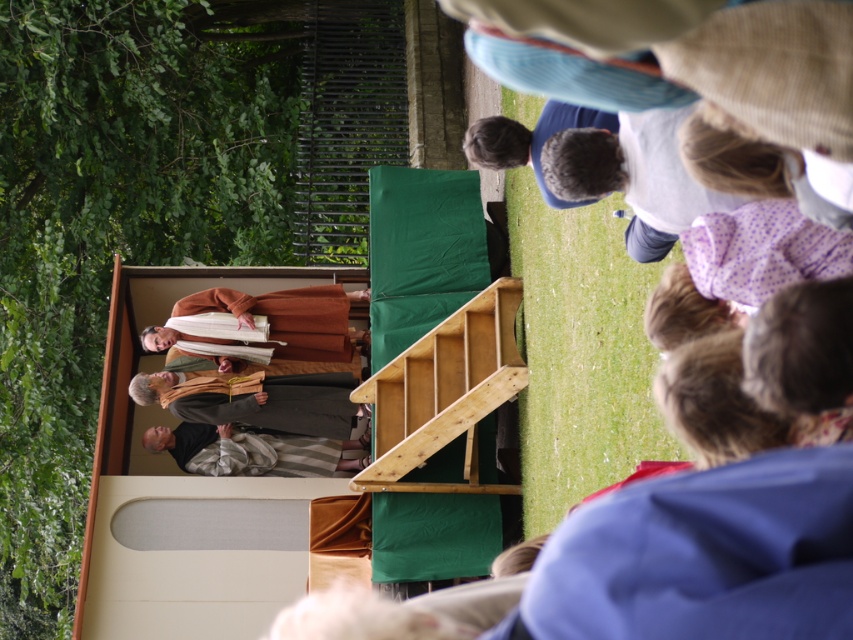
From the picture: You are standing at the entrance of the park and want to reach the stage where the performers are. The entrance is located at point 0.0, 0.0. According to the image, where should you head to find the light brown wooden stairs at center?

The light brown wooden stairs at center is located at point (444,394), so you should head to that coordinate to find the stairs leading to the stage.

Looking at this image, you are standing at the entrance of the park and want to reach the wooden platform where the performers are standing. The wooden platform is located at the point with coordinates [444,394]. Are the stairs leading to the platform visible from your current position?

The point [444,394] corresponds to the light brown wooden stairs at center, so yes, the stairs leading to the platform are visible from your current position at the entrance.